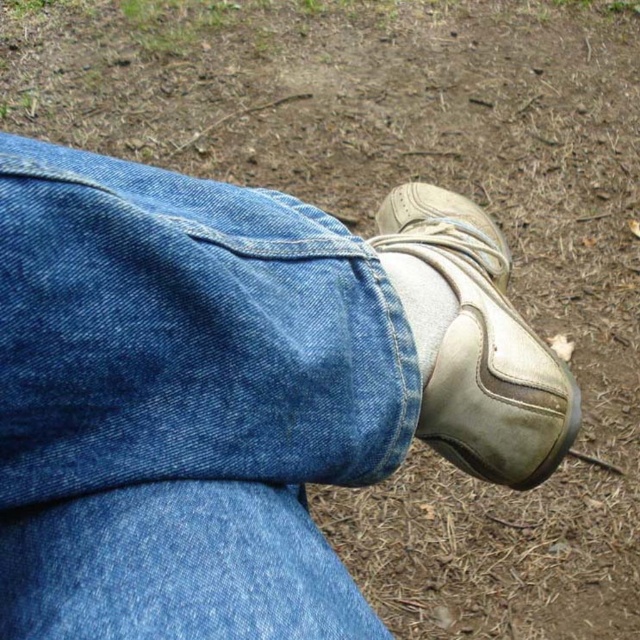
You are standing in a park and see the denim at lower right and the white leather shoe at lower center. Which object is located to the left of the other?

The denim at lower right is positioned on the left side of white leather shoe at lower center.

You are a photographer setting up a shoot in a park. You need to position a prop so that it sits above the white leather shoe at lower center but stays within the frame of the denim at lower right. Is this possible given their current positions?

The denim at lower right is below the white leather shoe at lower center, so placing a prop above the white leather shoe at lower center while keeping it within the denim at lower right would not be possible since the denim is already positioned below the shoe.